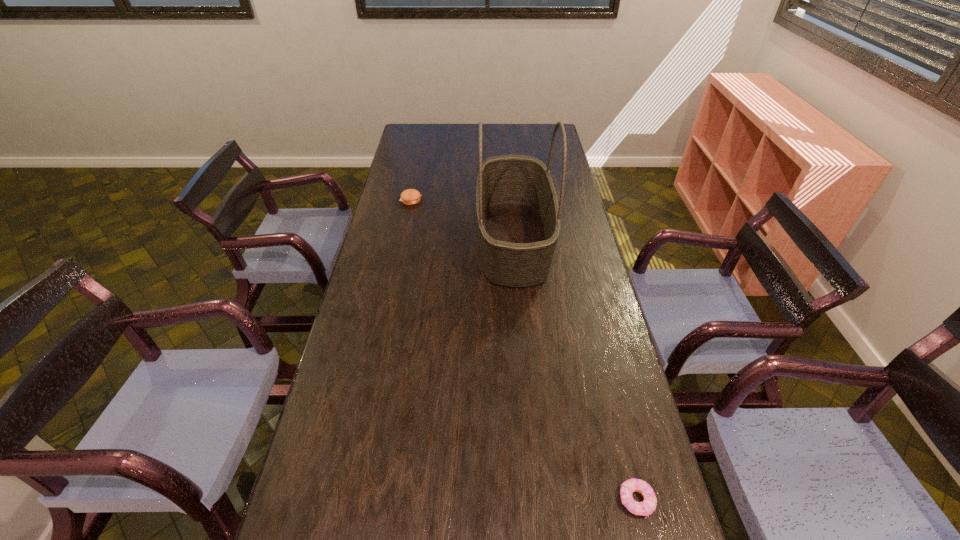
Where is `free space that satisfies the following two spatial constraints: 1. on the front side of the patty; 2. on the right side of the doughnut`? free space that satisfies the following two spatial constraints: 1. on the front side of the patty; 2. on the right side of the doughnut is located at coordinates (349, 500).